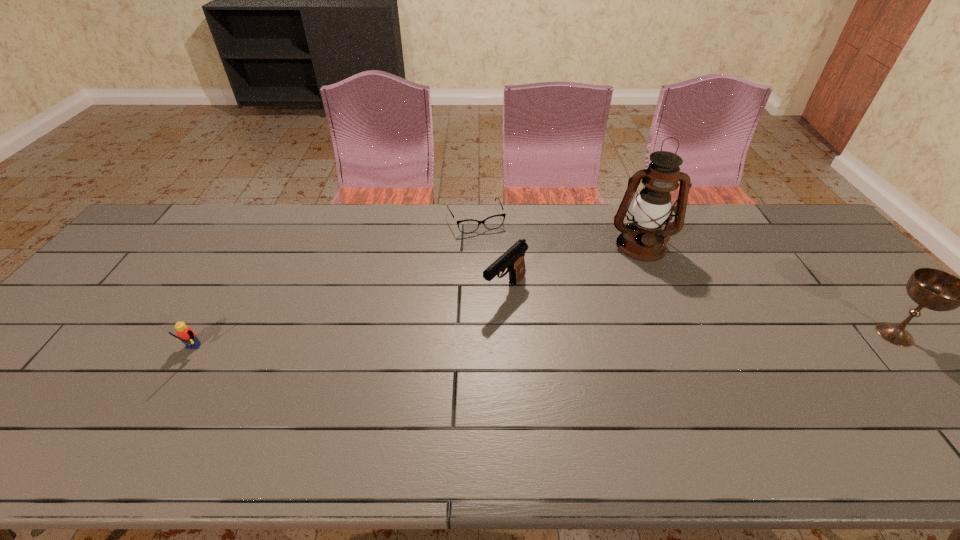
Where is `vacant space that satisfies the following two spatial constraints: 1. on the front side of the shortest object; 2. on the left side of the chalice`? The image size is (960, 540). vacant space that satisfies the following two spatial constraints: 1. on the front side of the shortest object; 2. on the left side of the chalice is located at coordinates (474, 334).